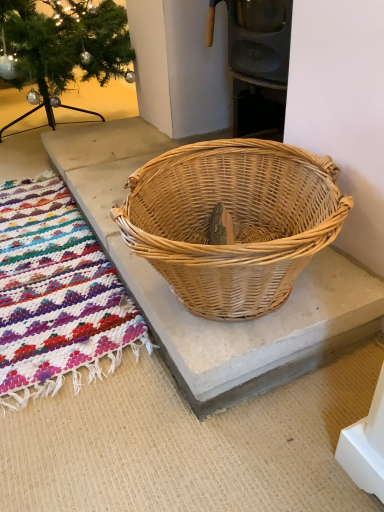
Locate an element on the screen. This screenshot has width=384, height=512. free point below natural wicker basket at center (from a real-world perspective) is located at coordinates (230, 320).